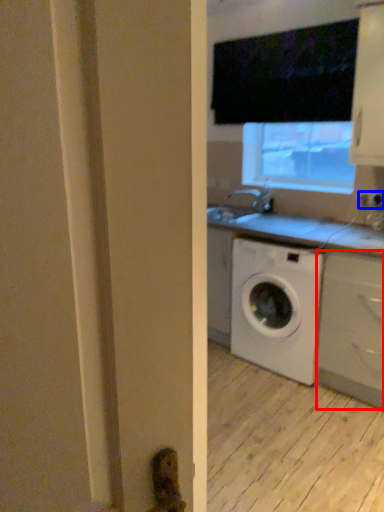
Question: Which object appears farthest to the camera in this image, cabinetry (highlighted by a red box) or electric outlet (highlighted by a blue box)?

Choices:
 (A) cabinetry
 (B) electric outlet

Answer: (B)